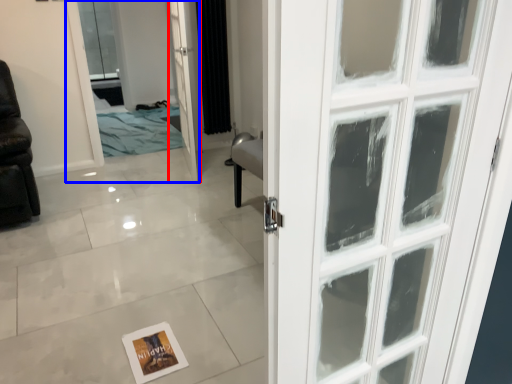
Question: Which point is further to the camera, door (highlighted by a red box) or elevator (highlighted by a blue box)?

Choices:
 (A) door
 (B) elevator

Answer: (B)